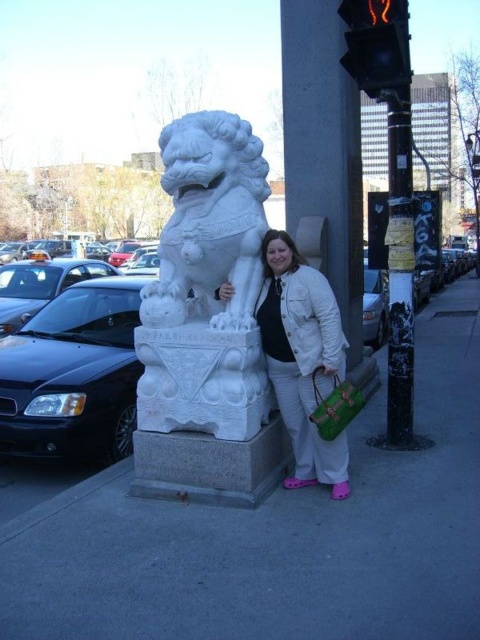
Does white stone statue at center have a lesser width compared to white matte jacket at center?

No, white stone statue at center is not thinner than white matte jacket at center.

Is white stone statue at center shorter than white matte jacket at center?

Yes.

This screenshot has height=640, width=480. What are the coordinates of `white stone statue at center` in the screenshot? It's located at (277, 534).

Is white stone statue at center to the right of white marble lion at center from the viewer's perspective?

Correct, you'll find white stone statue at center to the right of white marble lion at center.

From the picture: Who is more forward, [267,572] or [157,316]?

Positioned in front is point [267,572].

Does point (327, 541) lie in front of point (249, 388)?

Yes, it is.

This screenshot has width=480, height=640. Identify the location of white stone statue at center. (277, 534).

Which is below, black painted metal pole at right or brushed metal lamp post at upper right?

black painted metal pole at right is below.

Between black painted metal pole at right and brushed metal lamp post at upper right, which one is positioned higher?

Positioned higher is brushed metal lamp post at upper right.

The image size is (480, 640). I want to click on black painted metal pole at right, so click(x=399, y=273).